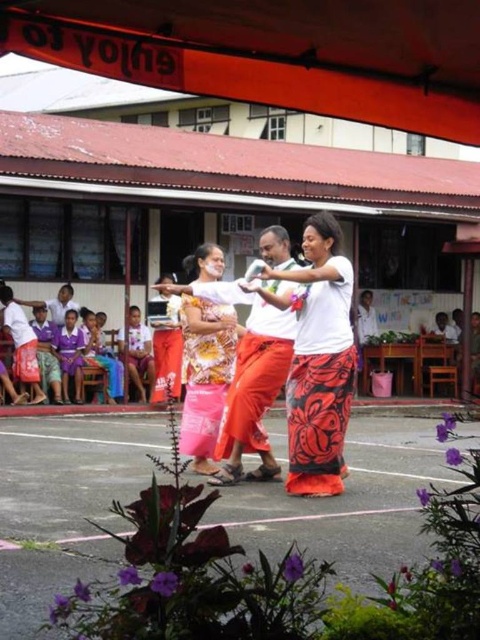
Consider the image. Who is more distant from viewer, (291, 486) or (265, 243)?

The point (265, 243) is behind.

Who is higher up, floral woven skirt at center or floral fabric skirt at center?

floral woven skirt at center is above.

This screenshot has width=480, height=640. I want to click on floral woven skirt at center, so click(320, 362).

Is floral fabric skirt at center positioned in front of patterned fabric dress at center?

Yes.

Between floral fabric skirt at center and patterned fabric dress at center, which one has less height?

patterned fabric dress at center is shorter.

Identify the location of floral fabric skirt at center. (252, 374).

You are a GUI agent. You are given a task and a screenshot of the screen. Output one action in this format:
    pyautogui.click(x=<x>, y=<y>)
    Task: Click on the floral fabric skirt at center
    
    Given the screenshot: What is the action you would take?
    pyautogui.click(x=252, y=374)

Who is positioned more to the right, floral woven skirt at center or patterned fabric dress at center?

Positioned to the right is floral woven skirt at center.

Is floral woven skirt at center taller than patterned fabric dress at center?

Yes.

What are the coordinates of `floral woven skirt at center` in the screenshot? It's located at (320, 362).